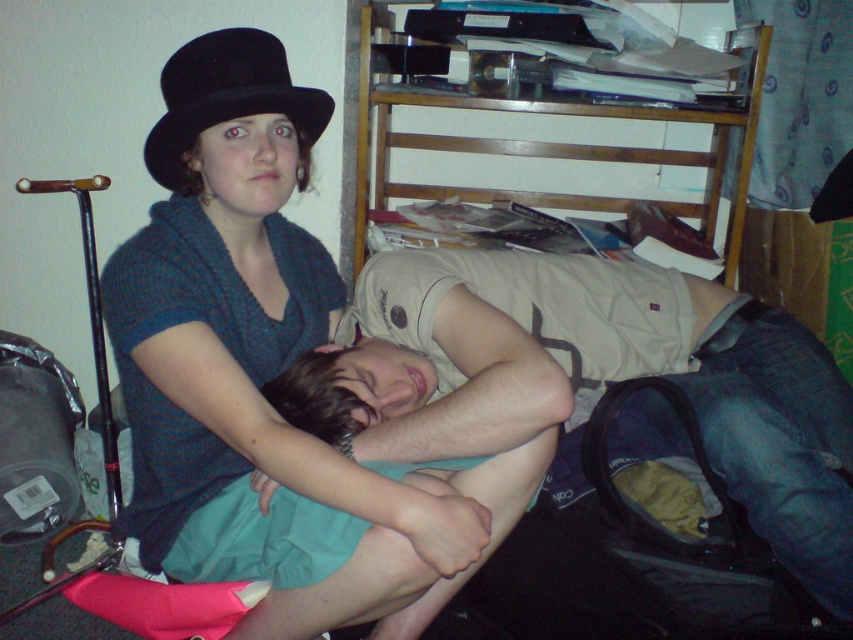
Question: Is matte black hat at upper left to the left of light beige cotton shirt at center from the viewer's perspective?

Choices:
 (A) no
 (B) yes

Answer: (B)

Question: Which of the following is the farthest from the observer?

Choices:
 (A) (138, 288)
 (B) (213, 106)
 (C) (331, 380)

Answer: (C)

Question: Which of the following is the farthest from the observer?

Choices:
 (A) matte black hat at upper left
 (B) light beige cotton shirt at center

Answer: (B)

Question: Does matte black hat at upper left appear over black felt fedora at upper left?

Choices:
 (A) yes
 (B) no

Answer: (B)

Question: Which point is closer to the camera?

Choices:
 (A) (178, 170)
 (B) (422, 541)
 (C) (718, 356)

Answer: (B)

Question: Can you confirm if matte black hat at upper left is positioned below light beige cotton shirt at center?

Choices:
 (A) no
 (B) yes

Answer: (A)